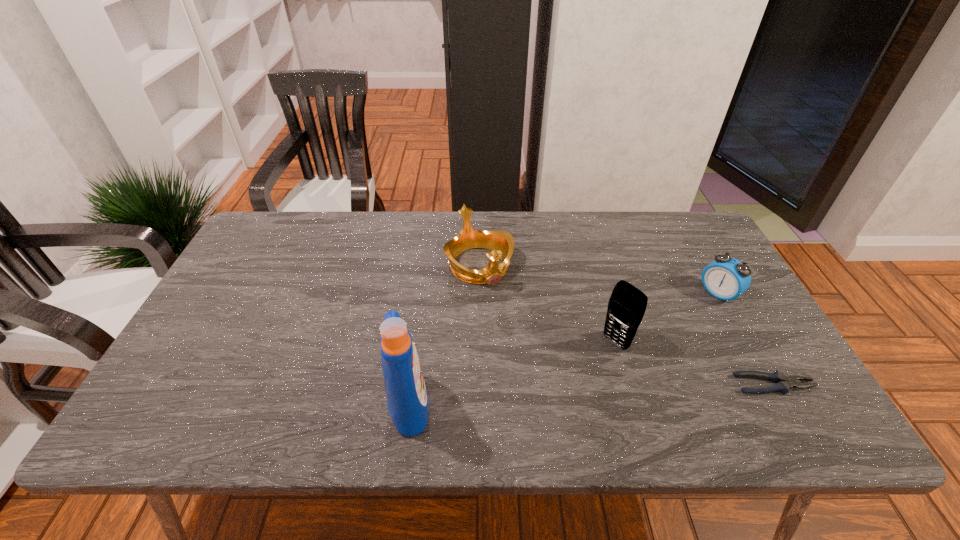
In order to click on vacant space situated 0.270m on the face of the alarm clock in this screenshot , I will do `click(646, 350)`.

Where is `vacant space situated 0.050m on the face of the alarm clock`? The image size is (960, 540). vacant space situated 0.050m on the face of the alarm clock is located at coordinates (698, 310).

Identify the location of vacant point located on the face of the alarm clock. The image size is (960, 540). (693, 314).

This screenshot has width=960, height=540. I want to click on vacant space located on the screen of the fourth shortest object, so click(545, 397).

Locate an element on the screen. vacant space located 0.100m on the screen of the fourth shortest object is located at coordinates (579, 372).

Locate an element on the screen. vacant space located on the screen of the fourth shortest object is located at coordinates (590, 362).

In order to click on object that is at the far edge in this screenshot , I will do 501,243.

At what (x,y) coordinates should I click in order to perform the action: click on detergent that is at the near edge. Please return your answer as a coordinate pair (x, y). The height and width of the screenshot is (540, 960). Looking at the image, I should click on (407, 399).

You are a GUI agent. You are given a task and a screenshot of the screen. Output one action in this format:
    pyautogui.click(x=<x>, y=<y>)
    Task: Click on the pliers that is positioned at the near edge
    This screenshot has width=960, height=540.
    Given the screenshot: What is the action you would take?
    pyautogui.click(x=783, y=383)

You are a GUI agent. You are given a task and a screenshot of the screen. Output one action in this format:
    pyautogui.click(x=<x>, y=<y>)
    Task: Click on the pliers at the right edge
    
    Given the screenshot: What is the action you would take?
    pyautogui.click(x=783, y=383)